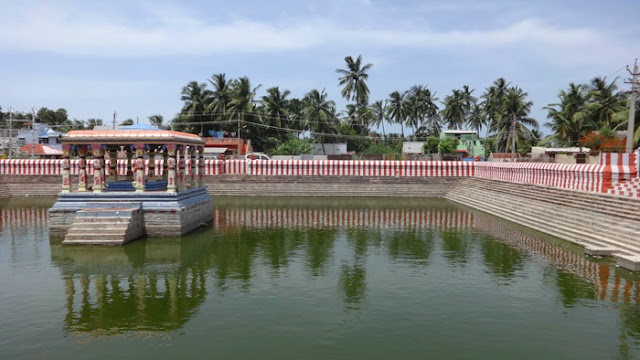
The image size is (640, 360). I want to click on pillar, so click(x=96, y=184).